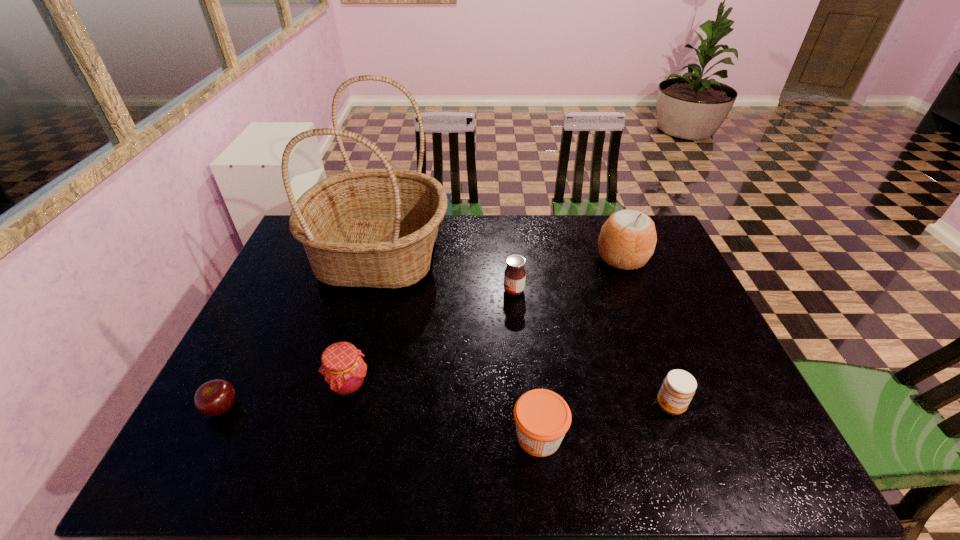
Identify the location of jam that is at the right edge. (678, 388).

At what (x,y) coordinates should I click in order to perform the action: click on object that is at the far left corner. Please return your answer as a coordinate pair (x, y). The width and height of the screenshot is (960, 540). Looking at the image, I should click on (376, 228).

Where is `object at the far right corner`? This screenshot has width=960, height=540. object at the far right corner is located at coordinates (627, 240).

In the image, there is a desktop. Identify the location of vacant space at the far edge. This screenshot has height=540, width=960. (533, 251).

The width and height of the screenshot is (960, 540). In order to click on free space at the near edge of the desktop in this screenshot , I will do `click(498, 451)`.

Find the location of a particular element. The image size is (960, 540). vacant region at the left edge of the desktop is located at coordinates (270, 402).

The height and width of the screenshot is (540, 960). In order to click on vacant space at the right edge in this screenshot , I will do `click(725, 402)`.

The image size is (960, 540). What are the coordinates of `vacant space in between the leftmost jam and the coconut` in the screenshot? It's located at (486, 321).

Where is `empty location between the leftmost jam and the sixth shortest object`? empty location between the leftmost jam and the sixth shortest object is located at coordinates (486, 321).

Identify the location of empty space between the apple and the rightmost jam. (446, 407).